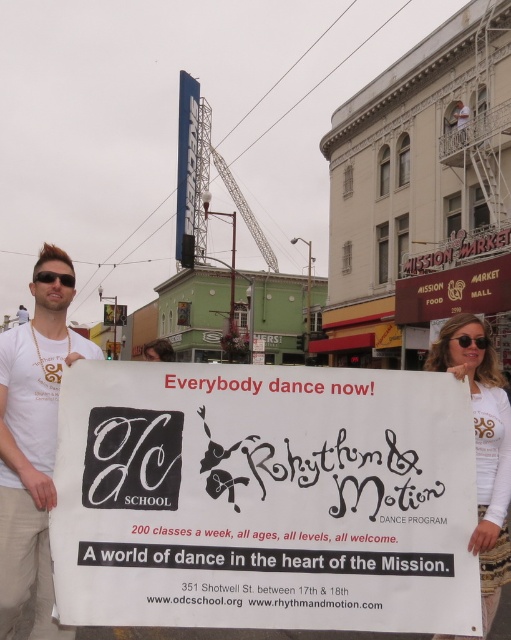
Question: Is white t-shirt at left bigger than white printed sign at center?

Choices:
 (A) yes
 (B) no

Answer: (A)

Question: Is white t-shirt at left wider than white printed sign at center?

Choices:
 (A) yes
 (B) no

Answer: (A)

Question: Does white paper sign at center appear under white printed sign at center?

Choices:
 (A) no
 (B) yes

Answer: (B)

Question: Among these points, which one is nearest to the camera?

Choices:
 (A) (241, 618)
 (B) (482, 348)
 (C) (439, 362)
 (D) (33, 394)

Answer: (A)

Question: Estimate the real-world distances between objects in this image. Which object is farther from the black plastic sunglasses at upper right?

Choices:
 (A) white paper sign at center
 (B) white printed sign at center
 (C) white t-shirt at left

Answer: (C)

Question: Which point is farther to the camera?

Choices:
 (A) white t-shirt at left
 (B) white printed sign at center
 (C) white paper sign at center

Answer: (B)